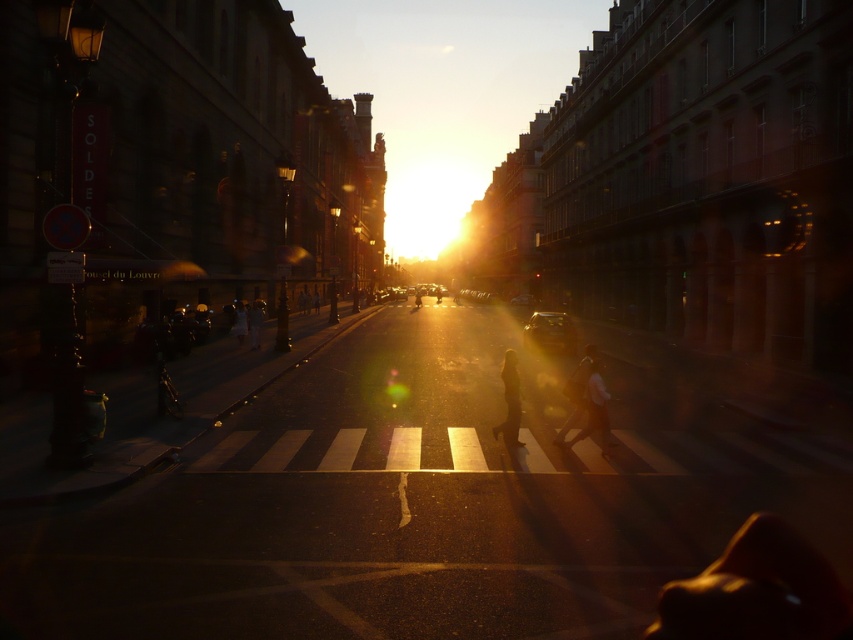
Looking at this image, you are a pedestrian standing at the pedestrian crossing looking down the street towards the sunset. You see a light brown leather jacket at center and a light brown leather bag at center. Which item is closer to you?

The light brown leather jacket at center is closer to you because it is in front of the light brown leather bag at center.